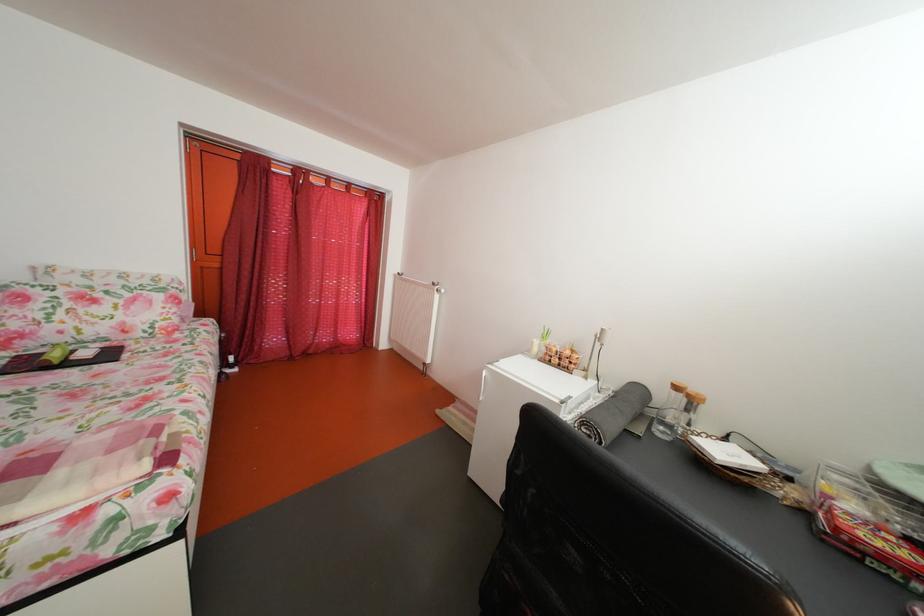
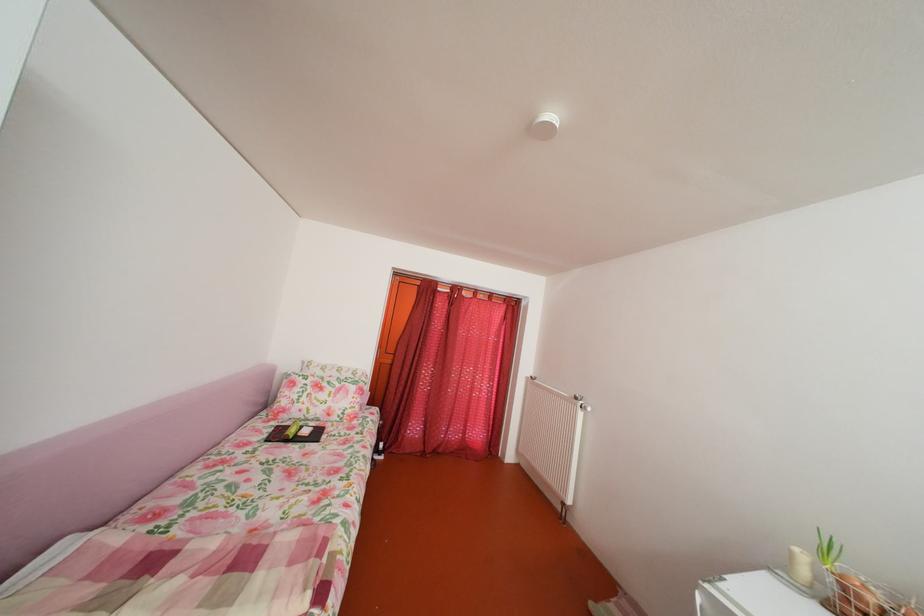
In the second image, find the point that corresponds to point (373, 235) in the first image.

(511, 337)